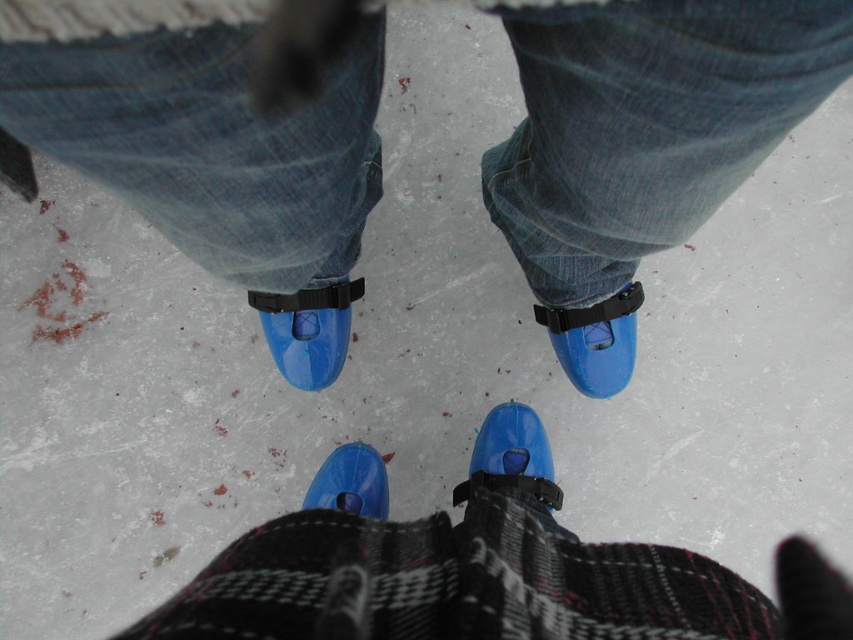
You are an ice rink attendant and need to place two skates, the blue matte ice skate at center and the translucent blue ice skate at center, on a display shelf. The shelf has a divider in the middle. Which skate should be placed on the left side of the divider to match the current arrangement?

The blue matte ice skate at center should be placed on the left side of the divider because it is positioned on the left side of the translucent blue ice skate at center in the current arrangement.

You are an ice skate technician inspecting two skates on the ice rink. You notice the blue matte ice skate at center and the translucent blue ice skate at center. Which one has a taller height?

The blue matte ice skate at center has a greater height compared to the translucent blue ice skate at center.

You are helping a customer choose between two pairs of ice skates displayed at the center of the store. The glossy plastic ice skates at center and the blue matte ice skate at center. The customer has narrow feet and wants a pair that fits snugly. Which pair would you recommend?

The blue matte ice skate at center has a smaller size compared to the glossy plastic ice skates at center, so it would be a better fit for someone with narrow feet who prefers a snug fit.